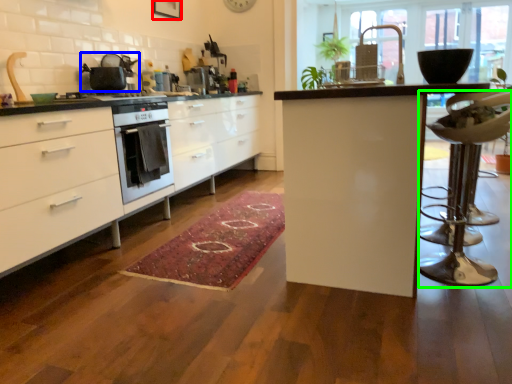
Question: Estimate the real-world distances between objects in this image. Which object is closer to picture frame (highlighted by a red box), kitchen appliance (highlighted by a blue box) or swivel chair (highlighted by a green box)?

Choices:
 (A) kitchen appliance
 (B) swivel chair

Answer: (A)